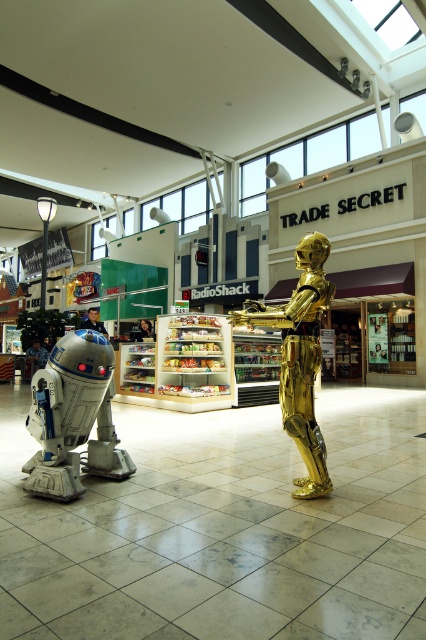
You are standing at the point marked by coordinates [74,417] in the shopping mall. Looking around, you see the silver metallic robot at left and the golden droid to its right. Which direction should you face to see the golden droid?

You should face to the right to see the golden droid, as the golden droid is positioned to the right of the silver metallic robot at left.

You are a visitor in the mall and want to take a photo of both the silver metallic robot at left and the gold metallic statue at center. From where you are standing, can you see both objects at the same time?

The silver metallic robot at left is positioned under the gold metallic statue at center, so yes, you can see both objects at the same time because the statue is above the robot.

You are a maintenance worker in the mall and need to move a 1.5 meter wide equipment between the silver metallic robot at left and the gold metallic statue at center. Can you fit the equipment through the space between them?

The silver metallic robot at left and gold metallic statue at center are 1.49 meters apart from each other. Since the equipment is 1.5 meters wide, it is slightly wider than the space available. Therefore, the equipment cannot fit through the space between them.